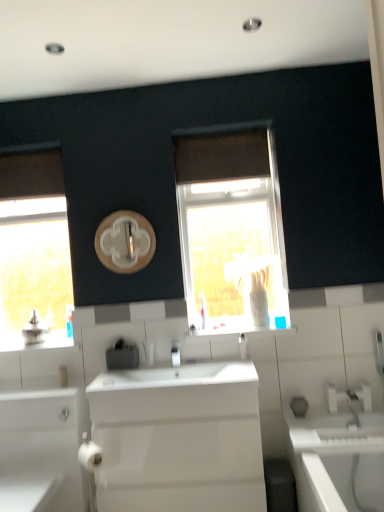
Image resolution: width=384 pixels, height=512 pixels. Identify the location of free spot to the right of silver metallic tap at center. (196, 364).